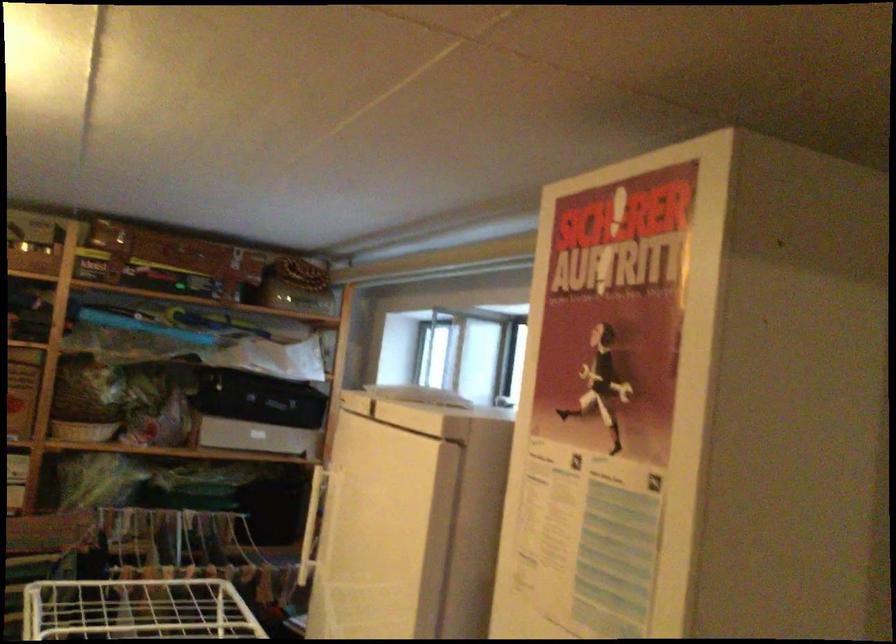
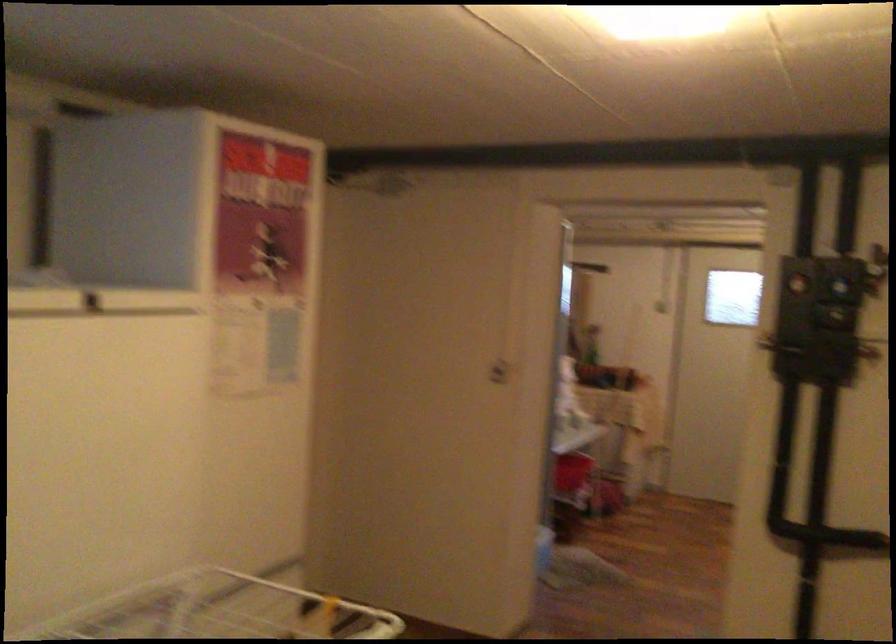
In the second image, find the point that corresponds to point (421, 424) in the first image.

(99, 301)